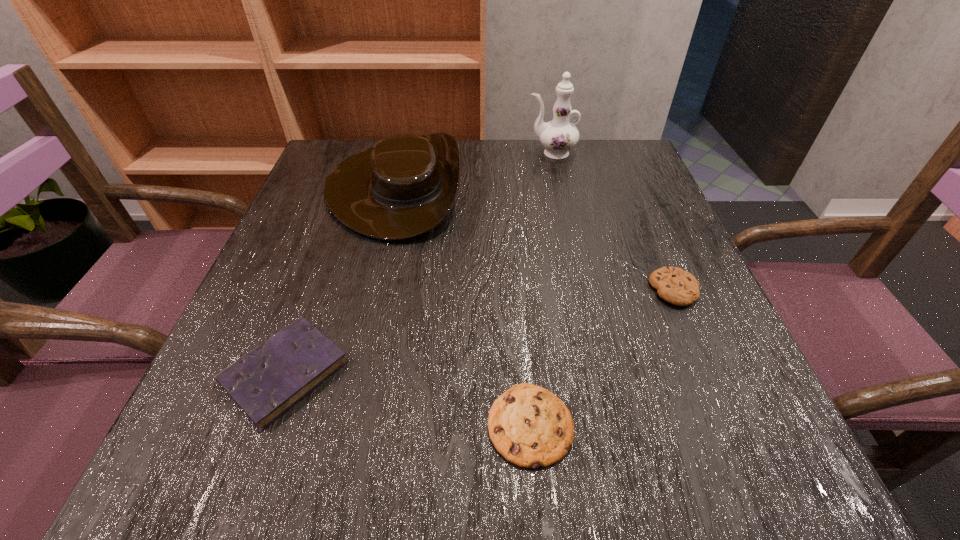
Image resolution: width=960 pixels, height=540 pixels. Find the location of `free space located 0.150m on the right of the fourth shortest object`. free space located 0.150m on the right of the fourth shortest object is located at coordinates (529, 187).

You are a GUI agent. You are given a task and a screenshot of the screen. Output one action in this format:
    pyautogui.click(x=<x>, y=<y>)
    Task: Click on the vacant region located 0.200m on the front of the rightmost object
    The height and width of the screenshot is (540, 960).
    Given the screenshot: What is the action you would take?
    pyautogui.click(x=731, y=421)

Identify the location of vacant space located on the back of the diary. The width and height of the screenshot is (960, 540). (325, 261).

Identify the location of vacant area located 0.390m on the back of the left cookie. (513, 219).

I want to click on chinaware situated at the far edge, so click(x=558, y=136).

Image resolution: width=960 pixels, height=540 pixels. In order to click on cowboy hat at the far edge in this screenshot , I will do `click(403, 187)`.

You are a GUI agent. You are given a task and a screenshot of the screen. Output one action in this format:
    pyautogui.click(x=<x>, y=<y>)
    Task: Click on the diary that is at the near edge
    
    Given the screenshot: What is the action you would take?
    pyautogui.click(x=266, y=382)

Identify the location of cookie that is at the near edge. This screenshot has height=540, width=960. (529, 426).

This screenshot has height=540, width=960. I want to click on cowboy hat that is at the left edge, so click(x=403, y=187).

Where is `diary that is at the left edge`? The height and width of the screenshot is (540, 960). diary that is at the left edge is located at coordinates (266, 382).